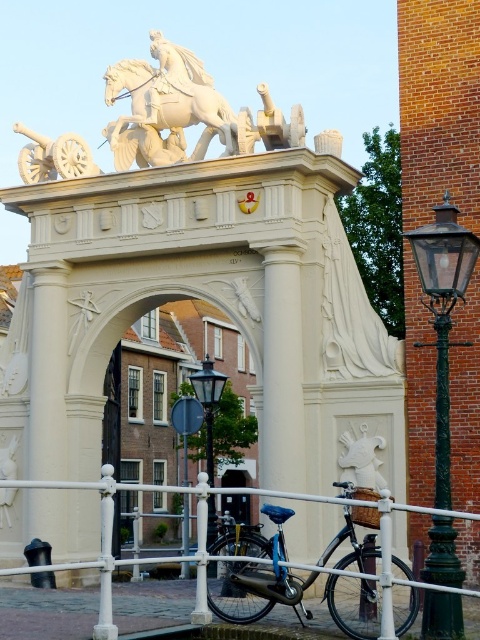
Question: Which of the following is the closest to the observer?

Choices:
 (A) (338, 563)
 (B) (112, 456)

Answer: (A)

Question: Which point appears closest to the camera in this image?

Choices:
 (A) (349, 563)
 (B) (214, 410)
 (C) (462, 252)
 (D) (101, 470)

Answer: (C)

Question: Does blue matte bicycle at center appear under black glass lamp post at center?

Choices:
 (A) no
 (B) yes

Answer: (B)

Question: Which object is farther from the camera taking this photo?

Choices:
 (A) green cast iron streetlight at right
 (B) blue matte bicycle at center
 (C) white marble horse at upper center

Answer: (C)

Question: Does green cast iron streetlight at right have a larger size compared to black glass lamp post at center?

Choices:
 (A) yes
 (B) no

Answer: (B)

Question: Can you confirm if white matte gate at center is positioned below black glass lamp post at center?

Choices:
 (A) no
 (B) yes

Answer: (B)